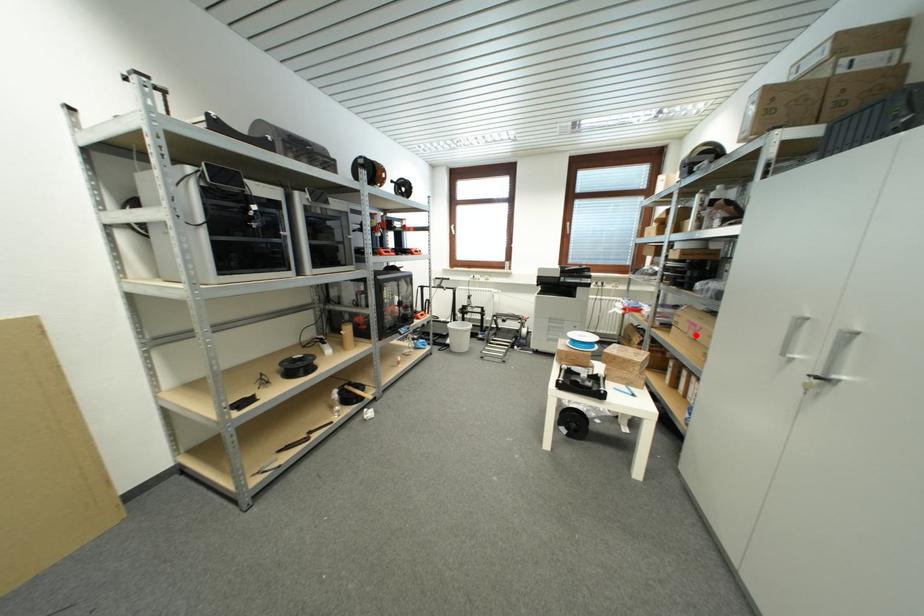
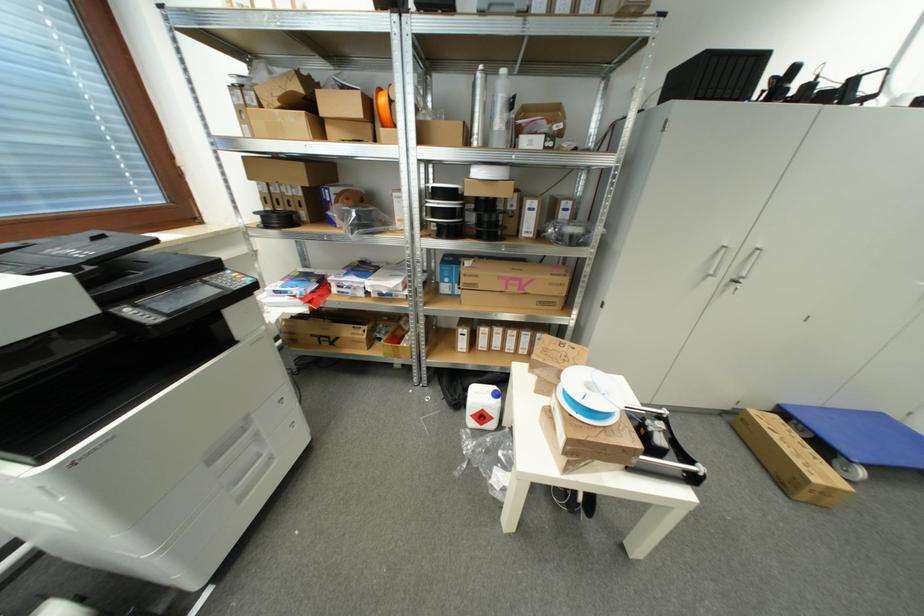
Question: I am providing you with two images of the same scene from different viewpoints. Given a red point in image1, look at the same physical point in image2. Is it:

Choices:
 (A) Closer to the viewpoint
 (B) Farther from the viewpoint

Answer: (B)